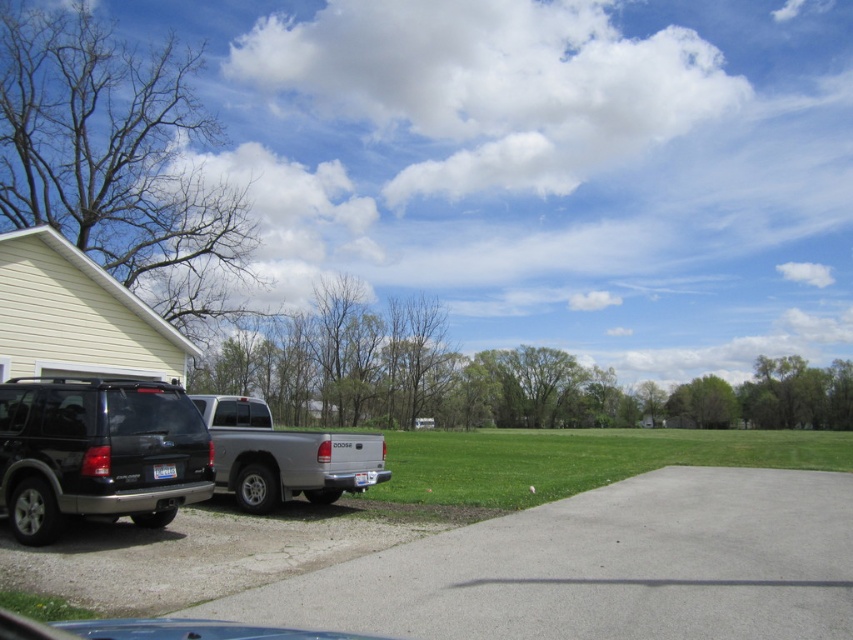
In the scene shown: You are a delivery person approaching the house and see the gray concrete driveway at lower left and the silver metallic truck at center. Which object is nearer to you as you arrive?

The gray concrete driveway at lower left is closer to the viewer than the silver metallic truck at center, so the gray concrete driveway at lower left is nearer to you as you arrive.

Looking at this image, you are a delivery person needing to park your van, which is 4 meters long, between the gray concrete driveway at lower left and the shiny black suv at lower left. Is there enough space for your van?

The distance between the gray concrete driveway at lower left and the shiny black suv at lower left is 3.96 meters. Since your van is 4 meters long, there isn not enough space to park it between them.

You are a delivery person approaching the house and need to park your vehicle. You see the gray concrete driveway at lower left and the shiny black suv at lower left. Which surface should you drive onto to park closer to the house?

The gray concrete driveway at lower left is closer to the viewer than the shiny black suv at lower left, so you should drive onto the gray concrete driveway at lower left to park closer to the house.